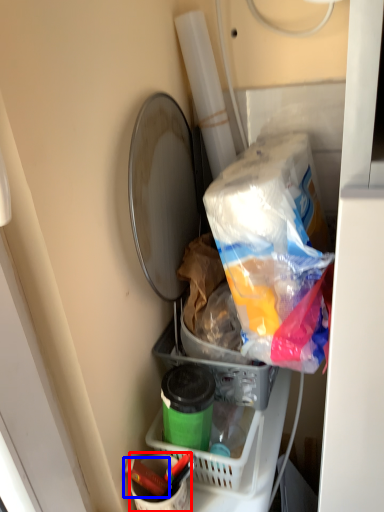
Question: Among these objects, which one is nearest to the camera, bucket (highlighted by a red box) or crayon (highlighted by a blue box)?

Choices:
 (A) bucket
 (B) crayon

Answer: (A)